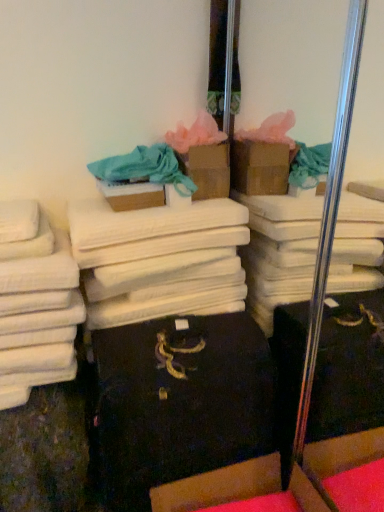
The width and height of the screenshot is (384, 512). Find the location of `vacant area that is in front of matte blue fabric at upper center`. vacant area that is in front of matte blue fabric at upper center is located at coordinates (126, 219).